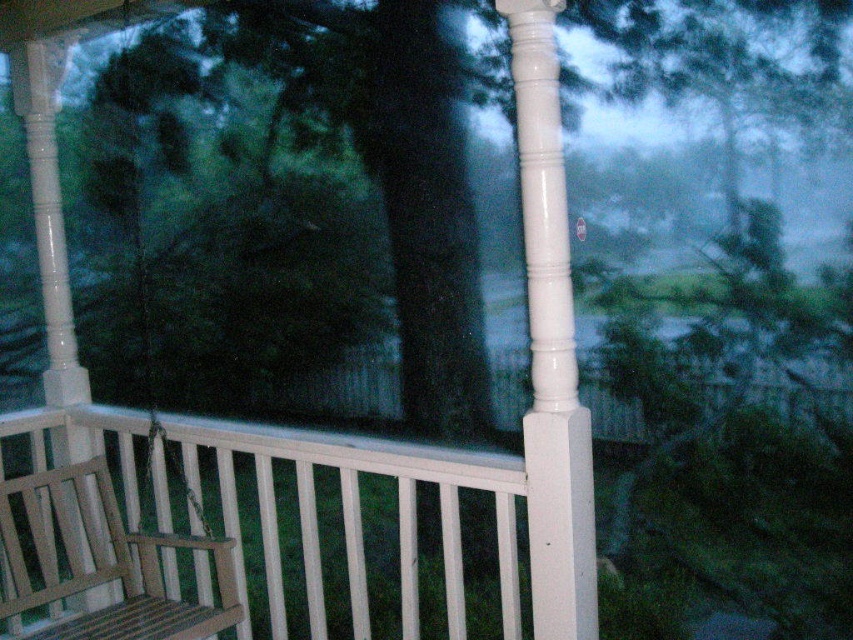
Question: Can you confirm if white painted wooden post at center is positioned to the left of teak wood rocking chair at lower left?

Choices:
 (A) no
 (B) yes

Answer: (A)

Question: Is white painted wooden post at center thinner than teak wood rocking chair at lower left?

Choices:
 (A) yes
 (B) no

Answer: (A)

Question: Among these objects, which one is farthest from the camera?

Choices:
 (A) white painted wooden post at center
 (B) teak wood rocking chair at lower left

Answer: (B)

Question: Which of the following is the farthest from the observer?

Choices:
 (A) (12, 580)
 (B) (581, 449)

Answer: (A)

Question: Can you confirm if white painted wooden post at center is wider than teak wood rocking chair at lower left?

Choices:
 (A) yes
 (B) no

Answer: (B)